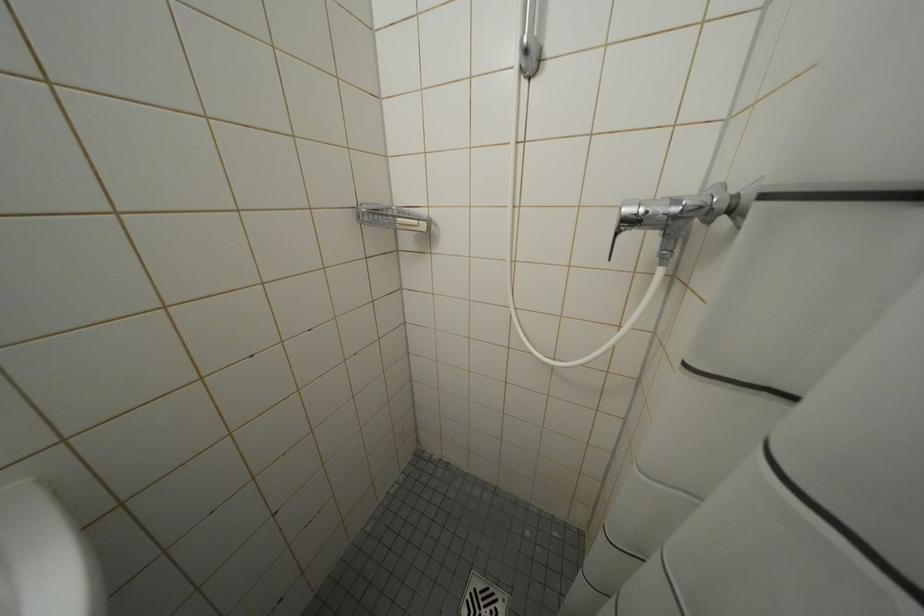
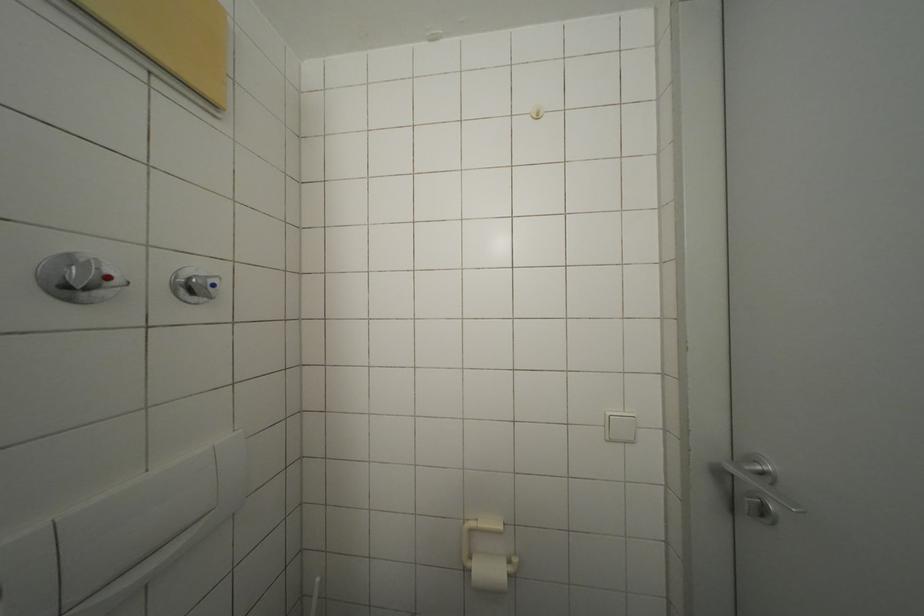
Question: How did the camera likely rotate?

Choices:
 (A) Left
 (B) Right
 (C) Up
 (D) Down

Answer: (B)